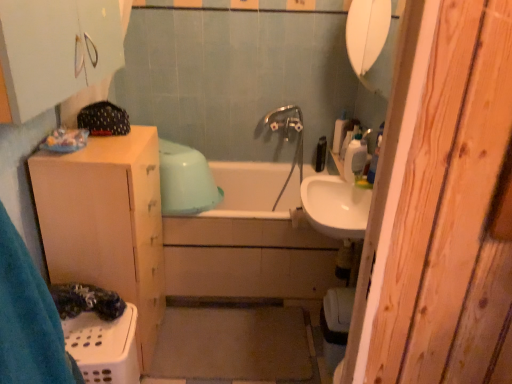
Question: Can you confirm if black plastic bottle at upper center, the third toiletry viewed from the front, is taller than white glossy sink at center?

Choices:
 (A) no
 (B) yes

Answer: (B)

Question: Is black plastic bottle at upper center, the third toiletry viewed from the front, further to the viewer compared to white glossy sink at center?

Choices:
 (A) no
 (B) yes

Answer: (B)

Question: Does black plastic bottle at upper center, the third toiletry viewed from the front, appear on the right side of white glossy sink at center?

Choices:
 (A) no
 (B) yes

Answer: (B)

Question: Considering the relative sizes of black plastic bottle at upper center, which is the 1th toiletry from back to front, and white glossy sink at center in the image provided, is black plastic bottle at upper center, which is the 1th toiletry from back to front, wider than white glossy sink at center?

Choices:
 (A) no
 (B) yes

Answer: (A)

Question: From the image's perspective, is black plastic bottle at upper center, the third toiletry viewed from the front, below white glossy sink at center?

Choices:
 (A) yes
 (B) no

Answer: (B)

Question: In terms of height, does chrome metallic faucet at center look taller or shorter compared to white plastic soap dispenser at upper right?

Choices:
 (A) tall
 (B) short

Answer: (A)

Question: In the image, is chrome metallic faucet at center positioned in front of or behind white plastic soap dispenser at upper right?

Choices:
 (A) front
 (B) behind

Answer: (B)

Question: From a real-world perspective, is chrome metallic faucet at center above or below white plastic soap dispenser at upper right?

Choices:
 (A) below
 (B) above

Answer: (A)

Question: From the image's perspective, relative to white plastic soap dispenser at upper right, is chrome metallic faucet at center above or below?

Choices:
 (A) below
 (B) above

Answer: (A)

Question: Is black plastic bottle at upper center, the third toiletry viewed from the front, in front of or behind white plastic laundry basket at lower left in the image?

Choices:
 (A) front
 (B) behind

Answer: (B)

Question: From the image's perspective, is black plastic bottle at upper center, the third toiletry viewed from the front, located above or below white plastic laundry basket at lower left?

Choices:
 (A) above
 (B) below

Answer: (A)

Question: In terms of width, does black plastic bottle at upper center, which is the 1th toiletry from back to front, look wider or thinner when compared to white plastic laundry basket at lower left?

Choices:
 (A) thin
 (B) wide

Answer: (A)

Question: From their relative heights in the image, would you say black plastic bottle at upper center, the third toiletry viewed from the front, is taller or shorter than white plastic laundry basket at lower left?

Choices:
 (A) tall
 (B) short

Answer: (B)

Question: From the image's perspective, is white plastic container at upper right, the 1th toiletry positioned from the front, positioned above or below white glossy sink at center?

Choices:
 (A) above
 (B) below

Answer: (A)

Question: Looking at their shapes, would you say white plastic container at upper right, marked as the 3th toiletry in a back-to-front arrangement, is wider or thinner than white glossy sink at center?

Choices:
 (A) thin
 (B) wide

Answer: (A)